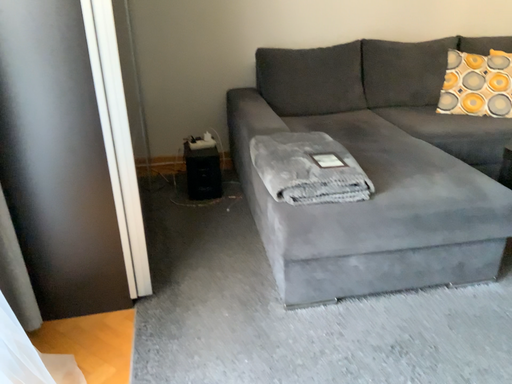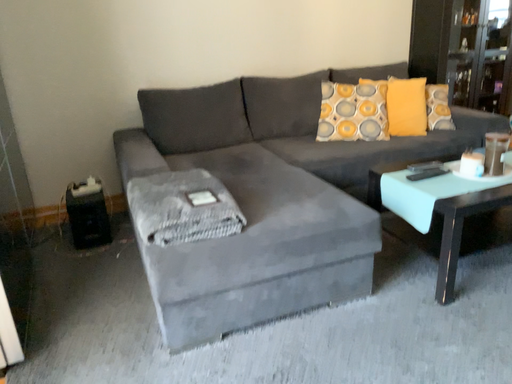
Question: Which way did the camera rotate in the video?

Choices:
 (A) rotated right
 (B) rotated left

Answer: (A)